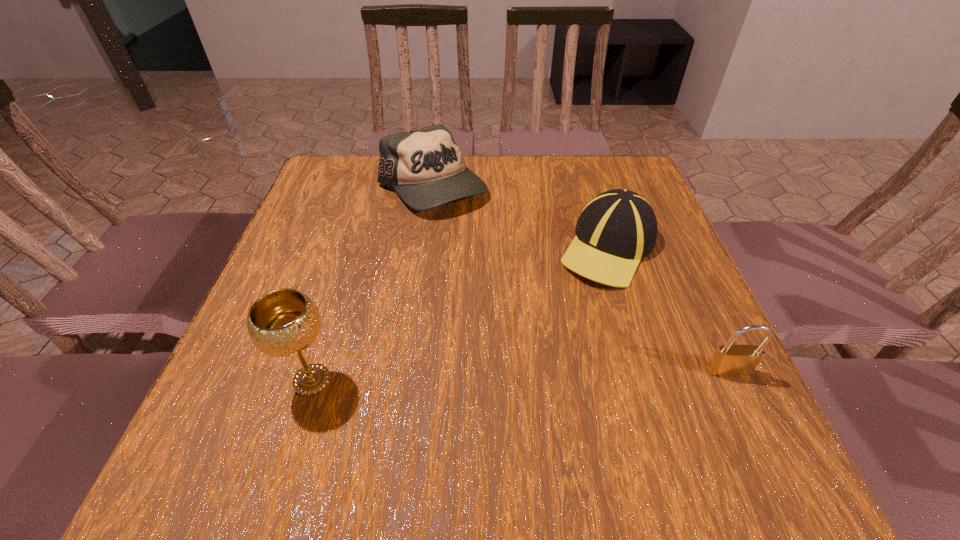
The width and height of the screenshot is (960, 540). I want to click on the tallest object, so click(284, 322).

Locate an element on the screen. padlock is located at coordinates (728, 360).

Find the location of `the right baseball cap`. the right baseball cap is located at coordinates (616, 229).

This screenshot has height=540, width=960. Identify the location of the left baseball cap. (426, 167).

Where is `vacant space situated 0.390m on the back of the tallest object`? The width and height of the screenshot is (960, 540). vacant space situated 0.390m on the back of the tallest object is located at coordinates (360, 224).

The height and width of the screenshot is (540, 960). In order to click on free space located 0.060m on the front-facing side of the padlock in this screenshot , I will do `click(745, 408)`.

Image resolution: width=960 pixels, height=540 pixels. Find the location of `vacant space located with the brim of the right baseball cap facing forward`. vacant space located with the brim of the right baseball cap facing forward is located at coordinates (560, 299).

Find the location of a particular element. Image resolution: width=960 pixels, height=540 pixels. free space located 0.290m with the brim of the right baseball cap facing forward is located at coordinates (492, 363).

The width and height of the screenshot is (960, 540). I want to click on vacant area located with the brim of the right baseball cap facing forward, so click(x=453, y=400).

Identify the location of vacant space located 0.200m on the front-facing side of the left baseball cap. (480, 270).